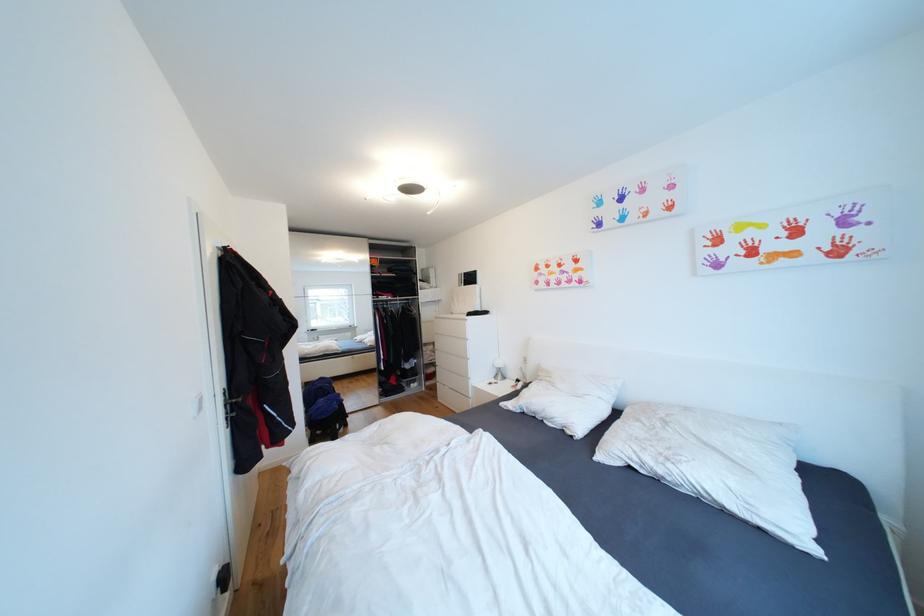
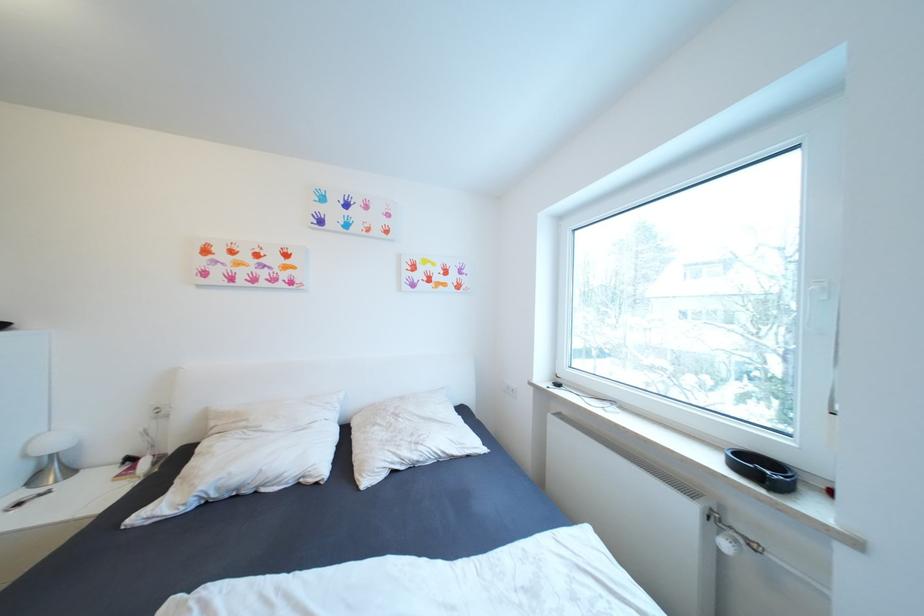
Question: How did the camera likely rotate?

Choices:
 (A) Left
 (B) Right
 (C) Up
 (D) Down

Answer: (B)